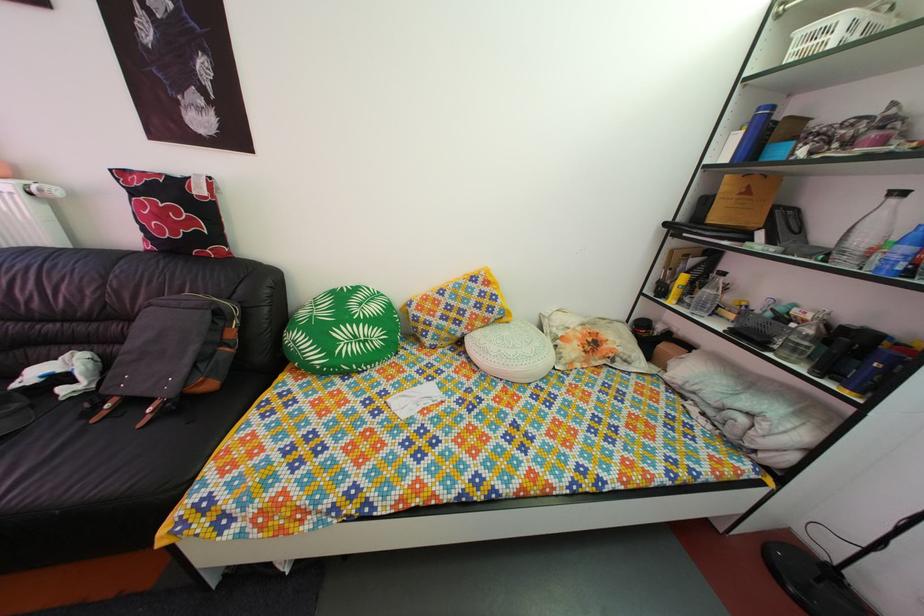
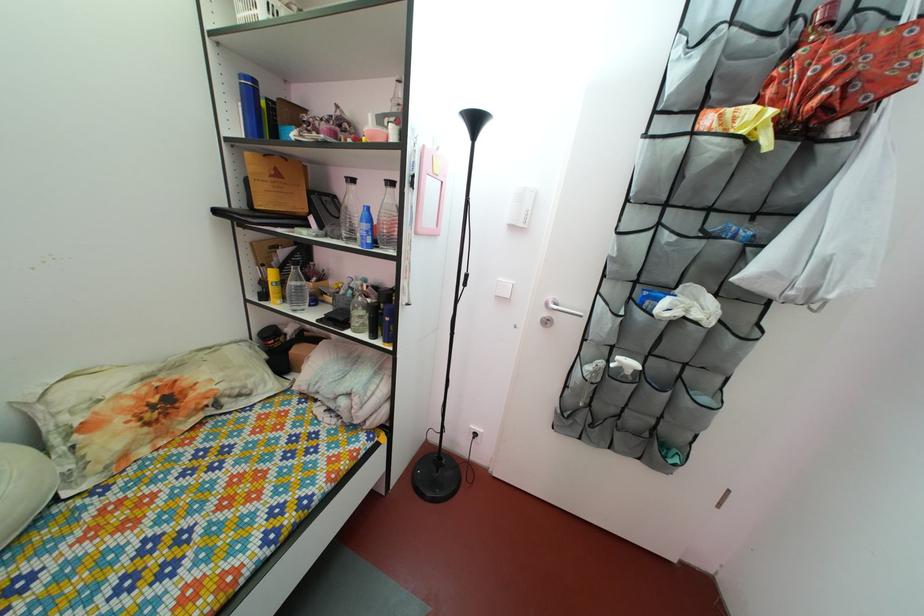
Find the pixel in the second image that matches [701,270] in the first image.

(292, 262)